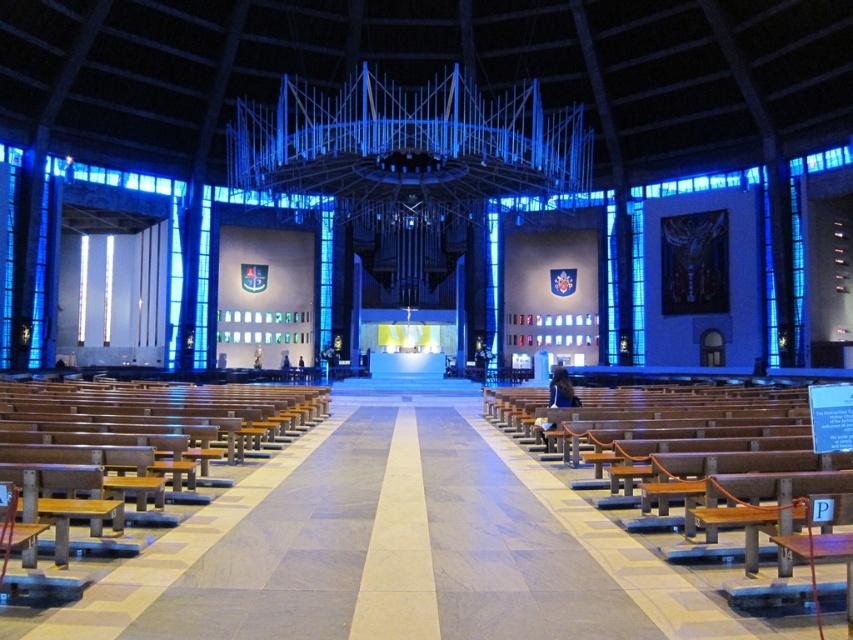
You are standing at the entrance of the church and want to sit down. You see the wooden polished bench at center and the brown wooden bench at left. Which bench is closer to you?

The wooden polished bench at center is closer to you than the brown wooden bench at left.

You are a visitor standing at the entrance of the church. You want to sit down near the altar. Which bench should you approach first, the wooden polished bench at center or the brown wooden bench at left?

You should approach the brown wooden bench at left first because the wooden polished bench at center is to the right of it, meaning the brown wooden bench at left is closer to the entrance where you are standing.